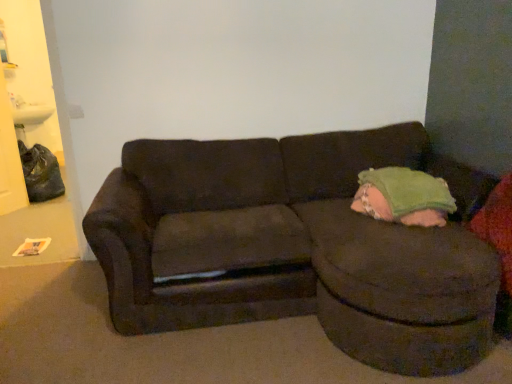
Question: Considering their positions, is dark brown fabric studio couch at center located in front of or behind soft pink blanket at right?

Choices:
 (A) front
 (B) behind

Answer: (A)

Question: In terms of height, does dark brown fabric studio couch at center look taller or shorter compared to soft pink blanket at right?

Choices:
 (A) short
 (B) tall

Answer: (B)

Question: In terms of width, does dark brown fabric studio couch at center look wider or thinner when compared to soft pink blanket at right?

Choices:
 (A) thin
 (B) wide

Answer: (B)

Question: In terms of width, does soft pink blanket at right look wider or thinner when compared to dark brown fabric studio couch at center?

Choices:
 (A) thin
 (B) wide

Answer: (A)

Question: Considering the positions of soft pink blanket at right and dark brown fabric studio couch at center in the image, is soft pink blanket at right bigger or smaller than dark brown fabric studio couch at center?

Choices:
 (A) big
 (B) small

Answer: (B)

Question: In terms of height, does soft pink blanket at right look taller or shorter compared to dark brown fabric studio couch at center?

Choices:
 (A) tall
 (B) short

Answer: (B)

Question: Would you say soft pink blanket at right is to the left or to the right of dark brown fabric studio couch at center in the picture?

Choices:
 (A) left
 (B) right

Answer: (B)